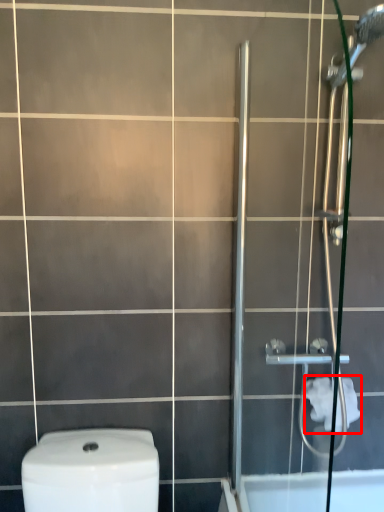
Question: From the image's perspective, where is toilet paper (annotated by the red box) located relative to screen door?

Choices:
 (A) below
 (B) above

Answer: (A)